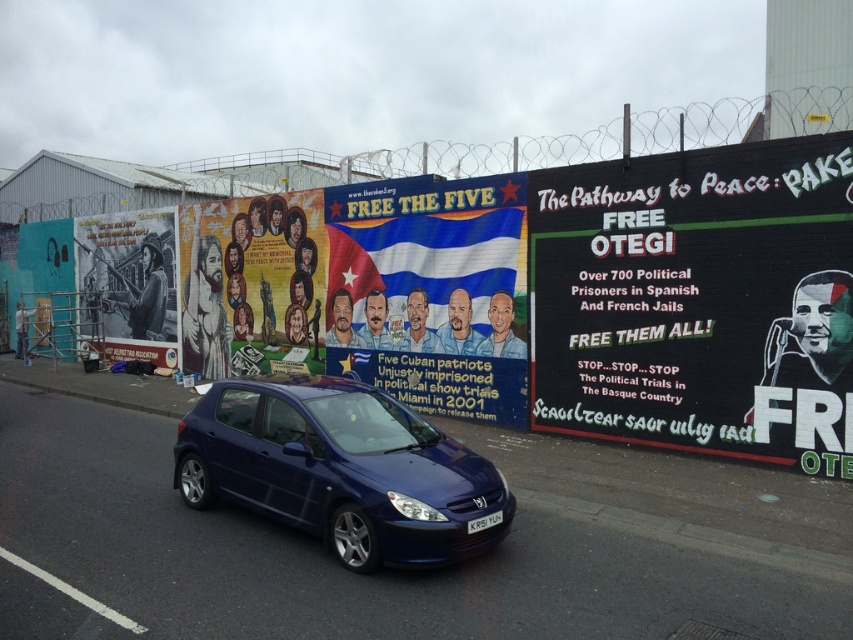
Question: Which of these objects is positioned closest to the black glossy poster at left?

Choices:
 (A) matte blue hatchback at center
 (B) matte paper poster at center

Answer: (B)

Question: Does matte paper poster at center appear on the right side of black glossy poster at left?

Choices:
 (A) no
 (B) yes

Answer: (B)

Question: Which is nearer to the matte paper poster at center?

Choices:
 (A) black matte billboard at right
 (B) blue fabric poster at center
 (C) black glossy poster at left
 (D) matte blue hatchback at center

Answer: (B)

Question: Does black matte billboard at right appear under matte blue hatchback at center?

Choices:
 (A) no
 (B) yes

Answer: (A)

Question: Which point appears closest to the camera in this image?

Choices:
 (A) (386, 464)
 (B) (778, 196)

Answer: (A)

Question: Does black matte billboard at right appear on the right side of black glossy poster at left?

Choices:
 (A) no
 (B) yes

Answer: (B)